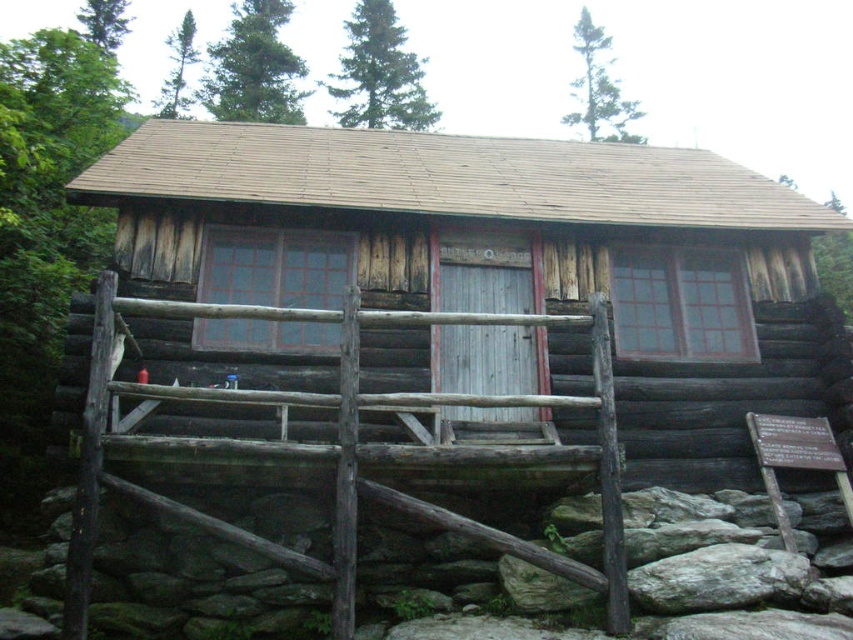
You are standing at the point marked as point (834, 268) in the image. What object is located at that point?

The green leafy tree at upper right is located at point (834, 268).

You are standing in front of the rustic wooden cabin at center and looking towards the green leafy tree at upper left. Which object appears taller from your perspective?

The green leafy tree at upper left appears taller than the rustic wooden cabin at center.